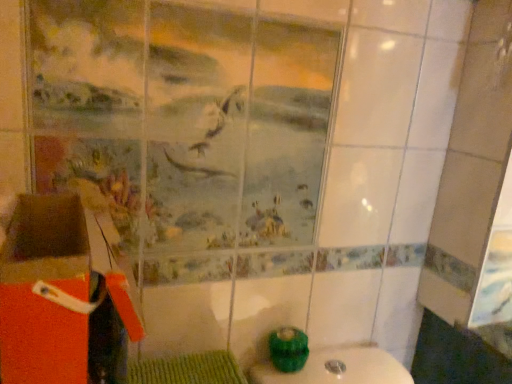
Question: Is teal glossy toilet bowl at lower center far away from orange cardboard box at lower left?

Choices:
 (A) yes
 (B) no

Answer: (B)

Question: Does teal glossy toilet bowl at lower center turn towards orange cardboard box at lower left?

Choices:
 (A) no
 (B) yes

Answer: (A)

Question: Can you confirm if teal glossy toilet bowl at lower center is smaller than orange cardboard box at lower left?

Choices:
 (A) no
 (B) yes

Answer: (B)

Question: Is orange cardboard box at lower left at the back of teal glossy toilet bowl at lower center?

Choices:
 (A) no
 (B) yes

Answer: (A)

Question: Can you confirm if teal glossy toilet bowl at lower center is shorter than orange cardboard box at lower left?

Choices:
 (A) yes
 (B) no

Answer: (A)

Question: Is the position of teal glossy toilet bowl at lower center more distant than that of orange cardboard box at lower left?

Choices:
 (A) no
 (B) yes

Answer: (B)

Question: Is orange cardboard box at lower left not within teal glossy toilet bowl at lower center?

Choices:
 (A) yes
 (B) no

Answer: (A)

Question: Does orange cardboard box at lower left have a lesser width compared to teal glossy toilet bowl at lower center?

Choices:
 (A) yes
 (B) no

Answer: (B)

Question: Is orange cardboard box at lower left not near teal glossy toilet bowl at lower center?

Choices:
 (A) yes
 (B) no

Answer: (B)

Question: Is the position of orange cardboard box at lower left less distant than that of teal glossy toilet bowl at lower center?

Choices:
 (A) no
 (B) yes

Answer: (B)

Question: Is teal glossy toilet bowl at lower center located within orange cardboard box at lower left?

Choices:
 (A) yes
 (B) no

Answer: (B)

Question: Is orange cardboard box at lower left at the left side of teal glossy toilet bowl at lower center?

Choices:
 (A) no
 (B) yes

Answer: (B)

Question: From a real-world perspective, is orange cardboard box at lower left positioned above or below teal glossy toilet bowl at lower center?

Choices:
 (A) below
 (B) above

Answer: (B)